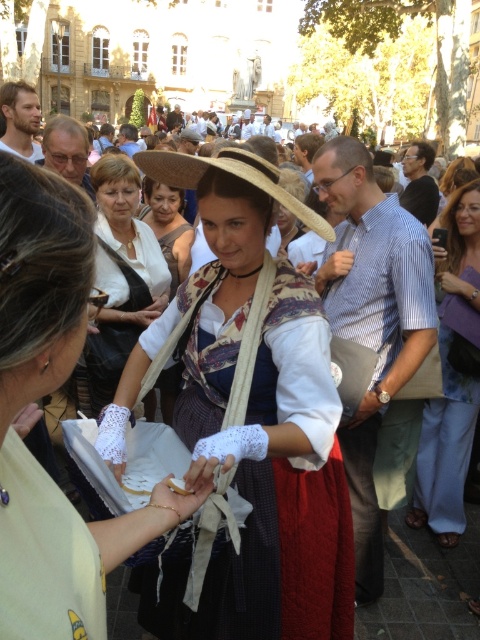
Can you confirm if matte straw hat at center is wider than matte white blouse at center?

Yes.

Does matte straw hat at center have a greater height compared to matte white blouse at center?

Yes.

Who is more distant from viewer, (216, 300) or (115, 362)?

The point (115, 362) is more distant.

The height and width of the screenshot is (640, 480). Identify the location of matte straw hat at center. (251, 419).

Which is in front, point (32, 465) or point (108, 202)?

Point (32, 465) is more forward.

Does matte white lace gloves at center have a larger size compared to matte white blouse at center?

Correct, matte white lace gloves at center is larger in size than matte white blouse at center.

Between point (9, 396) and point (123, 221), which one is positioned behind?

Point (123, 221)

You are a GUI agent. You are given a task and a screenshot of the screen. Output one action in this format:
    pyautogui.click(x=<x>, y=<y>)
    Task: Click on the matte white lace gloves at center
    This screenshot has width=480, height=640.
    Given the screenshot: What is the action you would take?
    pyautogui.click(x=39, y=397)

Between matte white blouse at center and straw hat at center, which one appears on the right side from the viewer's perspective?

Positioned to the right is straw hat at center.

Who is more forward, (128,349) or (182,188)?

Point (182,188)

Where is `matte white blouse at center`? Image resolution: width=480 pixels, height=640 pixels. matte white blouse at center is located at coordinates (121, 275).